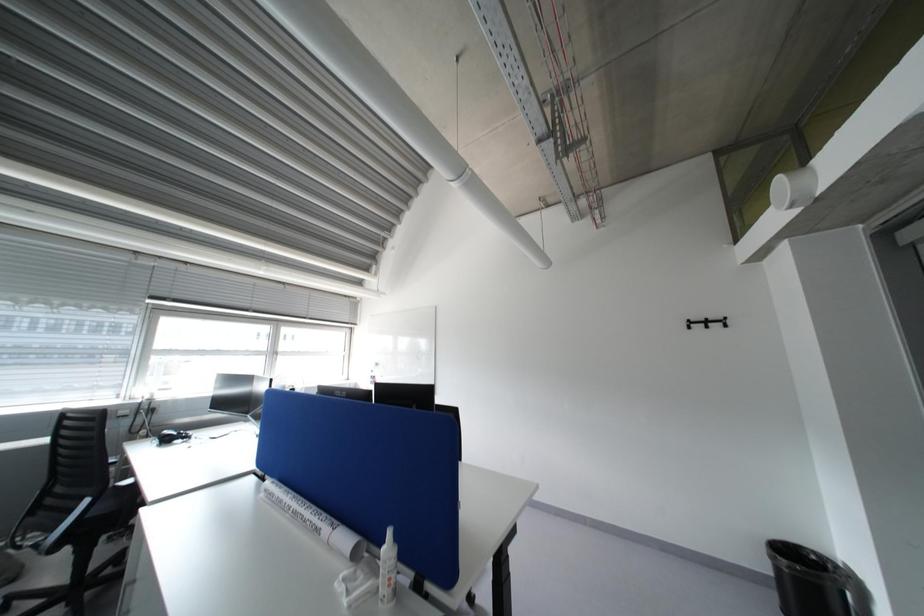
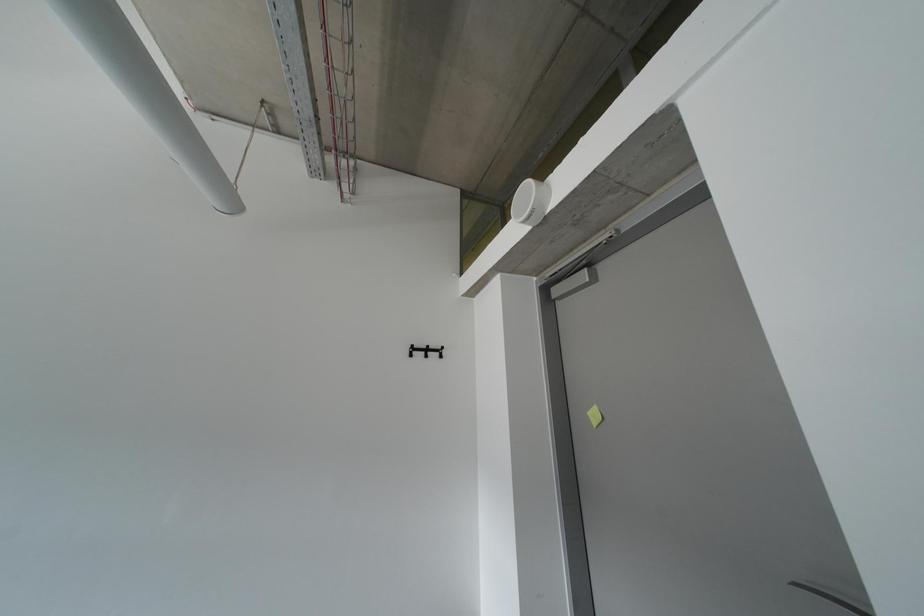
Question: How did the camera likely rotate?

Choices:
 (A) Left
 (B) Right
 (C) Up
 (D) Down

Answer: (B)